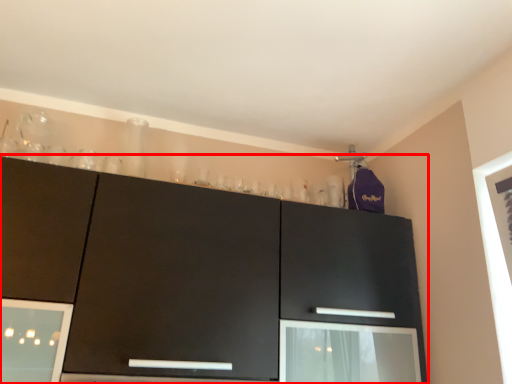
Question: Considering the relative positions of cabinetry (annotated by the red box) and screen door in the image provided, where is cabinetry (annotated by the red box) located with respect to the staircase?

Choices:
 (A) right
 (B) left

Answer: (B)